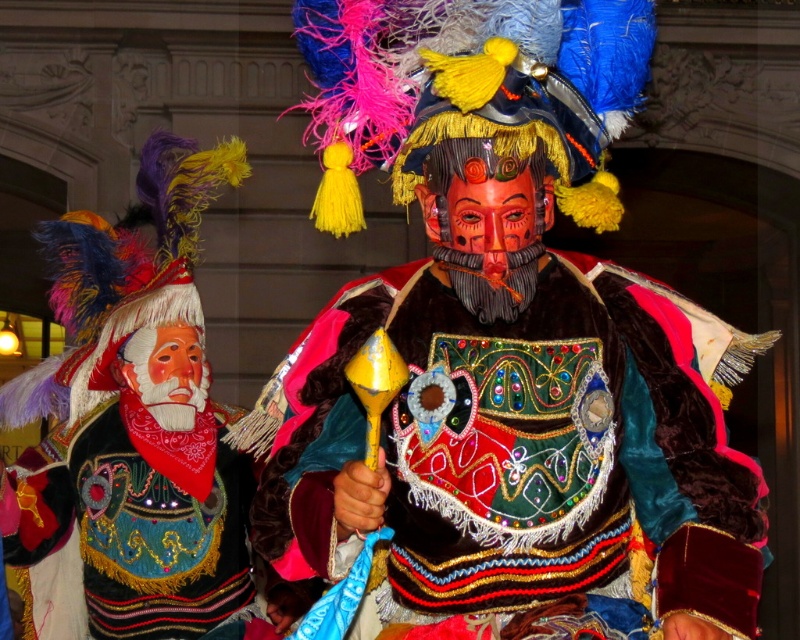
Question: Is velvet/cloth mask at center in front of matte black headdress at left?

Choices:
 (A) no
 (B) yes

Answer: (B)

Question: Can you confirm if velvet/cloth mask at center is positioned to the left of matte black headdress at left?

Choices:
 (A) no
 (B) yes

Answer: (A)

Question: Among these points, which one is farthest from the camera?

Choices:
 (A) (520, 282)
 (B) (196, 624)

Answer: (B)

Question: Is velvet/cloth mask at center positioned behind matte black headdress at left?

Choices:
 (A) yes
 (B) no

Answer: (B)